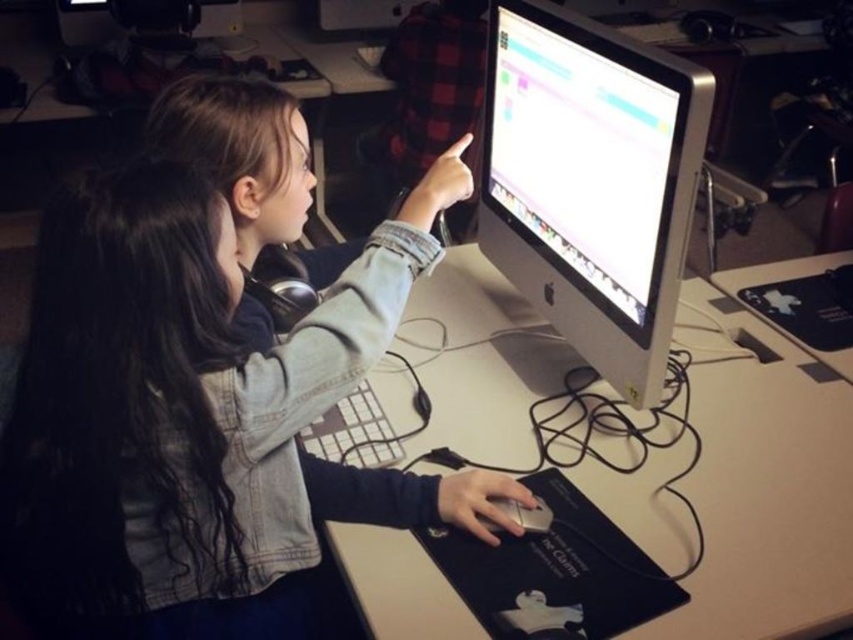
The height and width of the screenshot is (640, 853). What are the coordinates of `denim jacket at center` in the screenshot? It's located at (177, 413).

Does point (146, 518) come closer to viewer compared to point (515, 312)?

Yes, it is.

Locate an element on the screen. denim jacket at center is located at coordinates click(177, 413).

This screenshot has width=853, height=640. I want to click on denim jacket at center, so click(x=177, y=413).

Which of these two, white matte table at center or satin silver monitor at center, stands shorter?

satin silver monitor at center

Is white matte table at center to the right of satin silver monitor at center from the viewer's perspective?

Yes, white matte table at center is to the right of satin silver monitor at center.

Measure the distance between white matte table at center and camera.

white matte table at center and camera are 36.04 inches apart.

This screenshot has height=640, width=853. Identify the location of white matte table at center. (762, 481).

Who is taller, denim jacket at center or satin silver monitor at center?

Standing taller between the two is denim jacket at center.

Can you confirm if denim jacket at center is thinner than satin silver monitor at center?

No.

Which is behind, point (93, 252) or point (601, 298)?

Positioned behind is point (601, 298).

Locate an element on the screen. denim jacket at center is located at coordinates (177, 413).